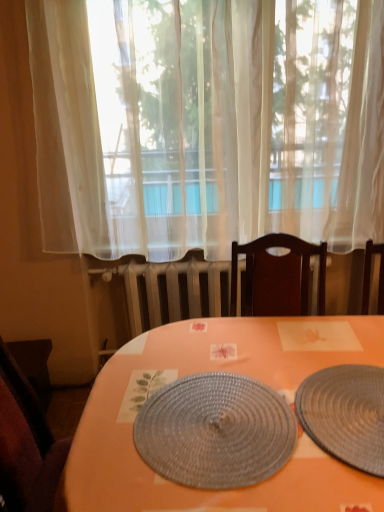
Question: Does white sheer curtain at center lie in front of dark brown wooden chair at lower left?

Choices:
 (A) no
 (B) yes

Answer: (B)

Question: Considering the relative sizes of white sheer curtain at center and dark brown wooden chair at lower left in the image provided, is white sheer curtain at center wider than dark brown wooden chair at lower left?

Choices:
 (A) no
 (B) yes

Answer: (A)

Question: Could you tell me if white sheer curtain at center is facing dark brown wooden chair at lower left?

Choices:
 (A) no
 (B) yes

Answer: (A)

Question: Is white sheer curtain at center positioned with its back to dark brown wooden chair at lower left?

Choices:
 (A) no
 (B) yes

Answer: (A)

Question: Is white sheer curtain at center to the right of dark brown wooden chair at lower left from the viewer's perspective?

Choices:
 (A) yes
 (B) no

Answer: (A)

Question: Based on their positions, is orange matte placemat at center located to the left or right of woven gray placemat at center, which is counted as the 1th plate, starting from the left?

Choices:
 (A) right
 (B) left

Answer: (A)

Question: Is orange matte placemat at center in front of or behind woven gray placemat at center, which is the 2th plate in right-to-left order, in the image?

Choices:
 (A) behind
 (B) front

Answer: (B)

Question: In terms of width, does orange matte placemat at center look wider or thinner when compared to woven gray placemat at center, which is the 2th plate in right-to-left order?

Choices:
 (A) thin
 (B) wide

Answer: (B)

Question: Do you think orange matte placemat at center is within woven gray placemat at center, which is the 2th plate in right-to-left order, or outside of it?

Choices:
 (A) outside
 (B) inside

Answer: (A)

Question: Is dark brown wooden chair at lower left situated inside woven gray placemat at center, which is counted as the 1th plate, starting from the left, or outside?

Choices:
 (A) outside
 (B) inside

Answer: (A)

Question: From a real-world perspective, is dark brown wooden chair at lower left positioned above or below woven gray placemat at center, which is counted as the 1th plate, starting from the left?

Choices:
 (A) below
 (B) above

Answer: (A)

Question: Would you say dark brown wooden chair at lower left is to the left or to the right of woven gray placemat at center, which is counted as the 1th plate, starting from the left, in the picture?

Choices:
 (A) left
 (B) right

Answer: (A)

Question: Relative to woven gray placemat at center, which is the 2th plate in right-to-left order, is dark brown wooden chair at lower left in front or behind?

Choices:
 (A) behind
 (B) front

Answer: (A)

Question: Relative to dark brown wooden chair at lower left, is orange matte placemat at center in front or behind?

Choices:
 (A) behind
 (B) front

Answer: (B)

Question: Based on their positions, is orange matte placemat at center located to the left or right of dark brown wooden chair at lower left?

Choices:
 (A) right
 (B) left

Answer: (A)